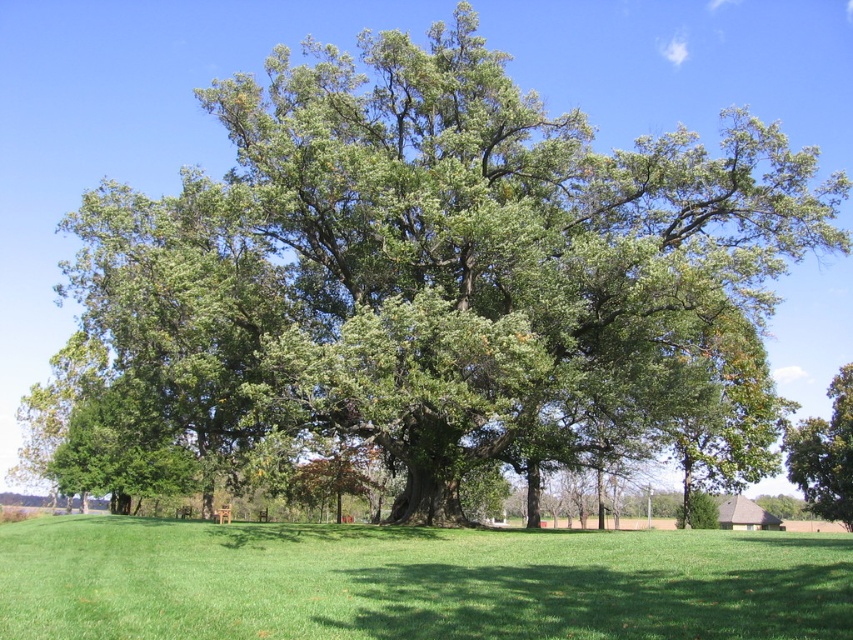
Question: Which point is farther from the camera taking this photo?

Choices:
 (A) (407, 586)
 (B) (795, 445)

Answer: (B)

Question: Is green grass at center bigger than green leafy tree at center?

Choices:
 (A) no
 (B) yes

Answer: (A)

Question: Which point is farther from the camera taking this photo?

Choices:
 (A) (846, 451)
 (B) (88, 636)

Answer: (A)

Question: Can you confirm if green grass at center is positioned to the right of green leafy tree at center?

Choices:
 (A) no
 (B) yes

Answer: (A)

Question: Does green grass at center appear on the right side of green leafy tree at center?

Choices:
 (A) no
 (B) yes

Answer: (A)